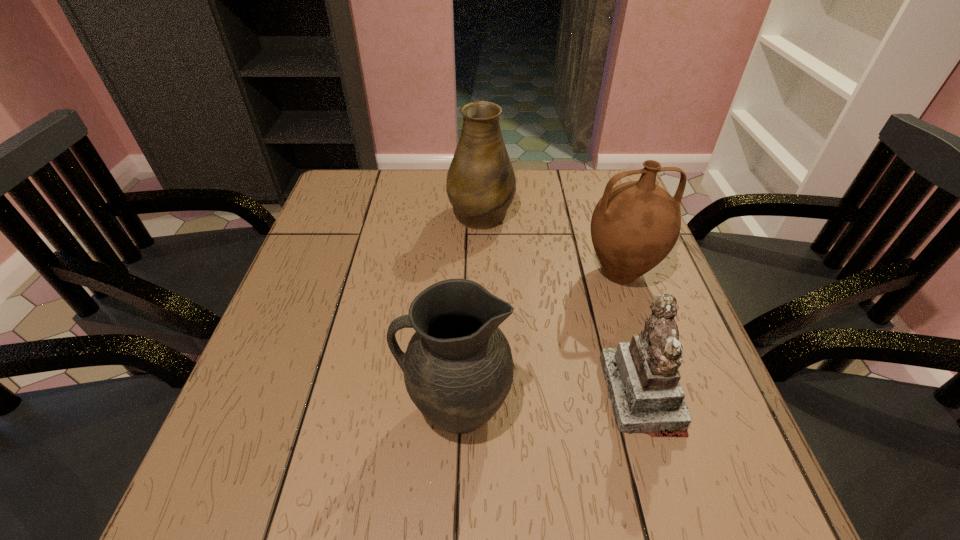
Identify the location of free space at the right edge of the desktop. The height and width of the screenshot is (540, 960). (617, 336).

This screenshot has height=540, width=960. What are the coordinates of `vacant space at the far left corner` in the screenshot? It's located at (383, 172).

This screenshot has width=960, height=540. I want to click on vacant space at the far right corner of the desktop, so click(x=596, y=195).

Find the location of a particular element. The image size is (960, 540). free space that is in between the figurine and the farthest object is located at coordinates (562, 303).

Where is `free space between the shortest object and the nearest pitcher`? The width and height of the screenshot is (960, 540). free space between the shortest object and the nearest pitcher is located at coordinates (549, 402).

The image size is (960, 540). Find the location of `free space between the rightmost pitcher and the farthest pitcher`. free space between the rightmost pitcher and the farthest pitcher is located at coordinates point(551,243).

Find the location of `free space between the farthest pitcher and the second farthest object`. free space between the farthest pitcher and the second farthest object is located at coordinates (551, 243).

Identify the location of vacant area that lies between the nearest pitcher and the third nearest object. (539, 341).

Locate an element on the screen. empty space between the third nearest object and the farthest pitcher is located at coordinates (551, 243).

The width and height of the screenshot is (960, 540). I want to click on free spot between the figurine and the farthest pitcher, so click(562, 303).